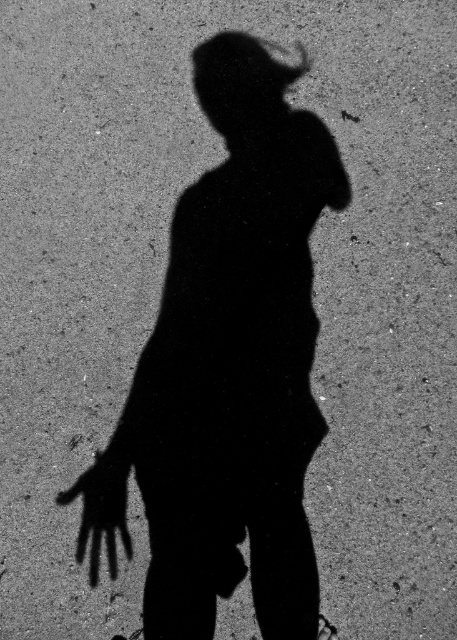
Find the location of `black shadow girl at center`. black shadow girl at center is located at coordinates (228, 369).

Can you confirm if black shadow girl at center is smaller than black matte hand at center?

No, black shadow girl at center is not smaller than black matte hand at center.

Image resolution: width=457 pixels, height=640 pixels. Describe the element at coordinates (228, 369) in the screenshot. I see `black shadow girl at center` at that location.

At what (x,y) coordinates should I click in order to perform the action: click on black shadow girl at center. Please return your answer as a coordinate pair (x, y). Image resolution: width=457 pixels, height=640 pixels. Looking at the image, I should click on (228, 369).